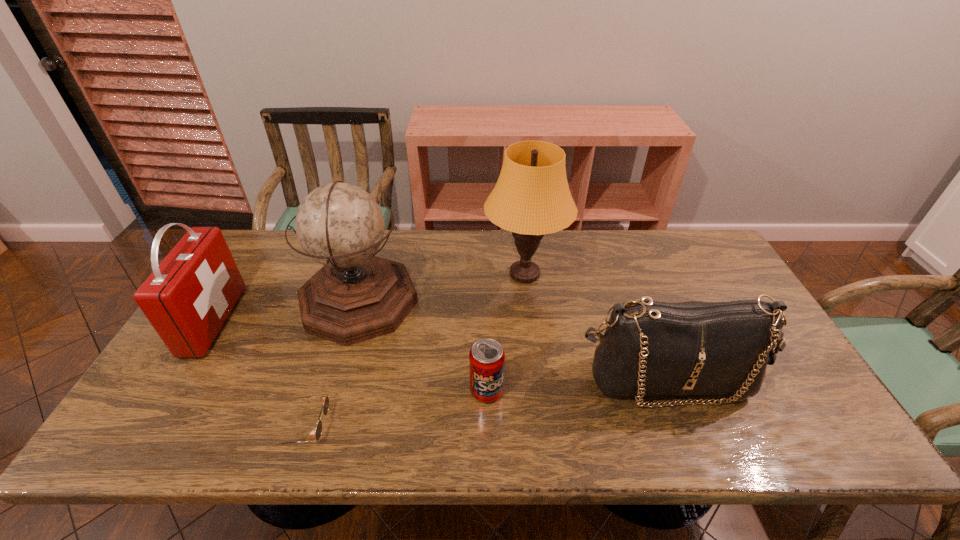
Identify the location of blank space located on the front lenses of the shortest object. (490, 427).

Locate an element on the screen. Image resolution: width=960 pixels, height=540 pixels. lampshade that is at the far edge is located at coordinates (531, 198).

This screenshot has height=540, width=960. I want to click on globe that is positioned at the far edge, so click(356, 296).

Locate an element on the screen. object that is at the near edge is located at coordinates (325, 399).

In order to click on object located in the left edge section of the desktop in this screenshot , I will do (187, 298).

Locate an element on the screen. The image size is (960, 540). object at the right edge is located at coordinates (649, 348).

Locate an element on the screen. The height and width of the screenshot is (540, 960). blank area at the far edge is located at coordinates (502, 237).

The width and height of the screenshot is (960, 540). I want to click on vacant region at the near edge of the desktop, so click(293, 436).

You are a GUI agent. You are given a task and a screenshot of the screen. Output one action in this format:
    pyautogui.click(x=<x>, y=<y>)
    Task: Click on the blank area at the left edge
    The width and height of the screenshot is (960, 540).
    Given the screenshot: What is the action you would take?
    pyautogui.click(x=179, y=409)

In order to click on vacant space at the right edge in this screenshot , I will do `click(730, 289)`.